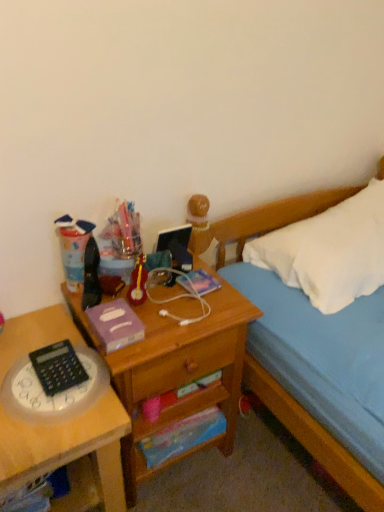
Identify the location of free space above wooden desk at center, the 2th desk in the left-to-right sequence (from a real-world perspective). The height and width of the screenshot is (512, 384). (166, 302).